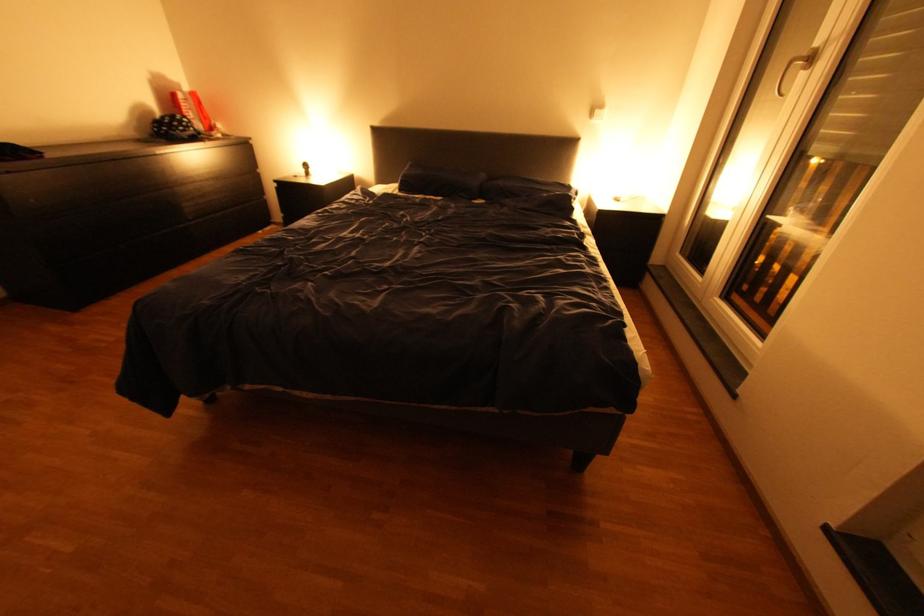
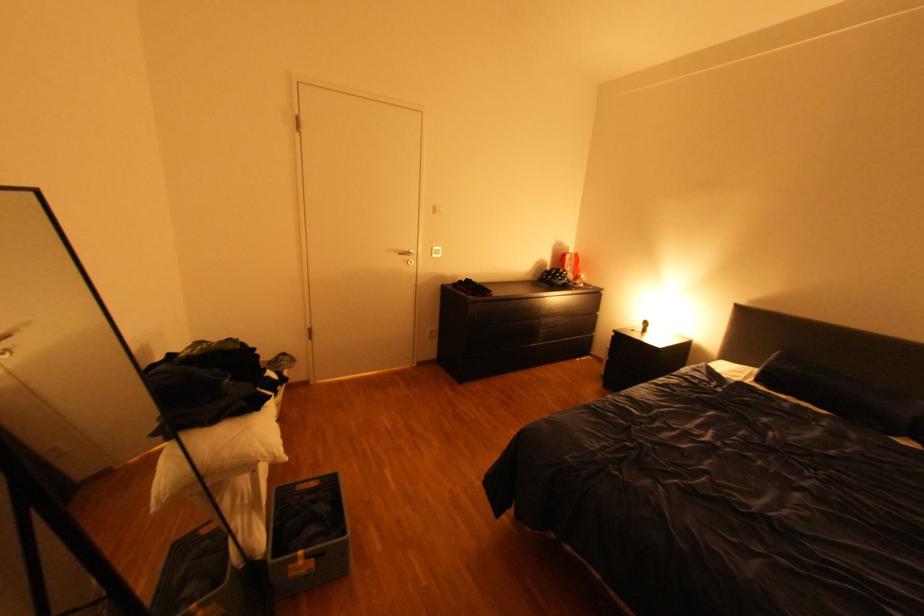
Find the pixel in the second image that matches the point at 320,169 in the first image.

(659, 328)